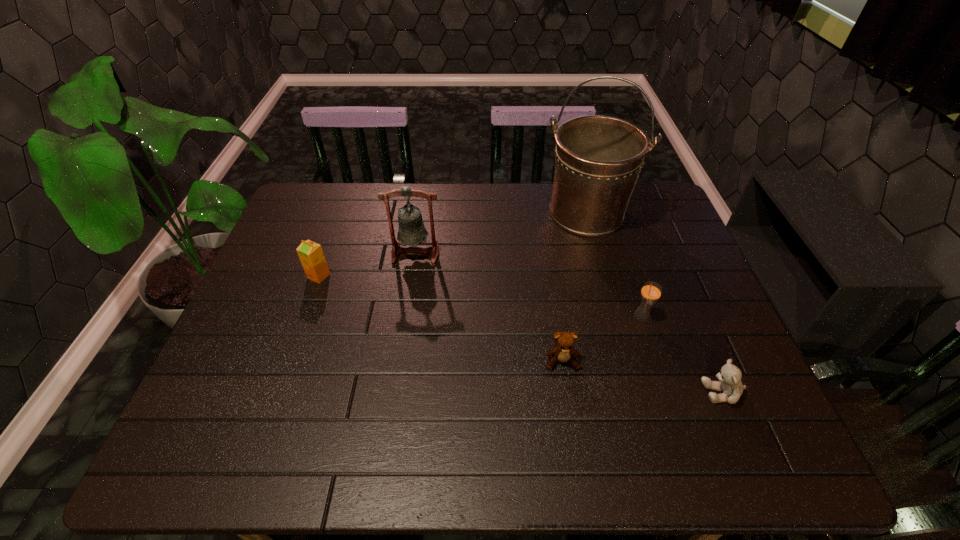
Identify which object is located as the fourth nearest to the fifth nearest object. Please provide its 2D coordinates. Your answer should be formatted as a tuple, i.e. [(x, y)], where the tuple contains the x and y coordinates of a point satisfying the conditions above.

[(651, 291)]

The image size is (960, 540). What are the coordinates of `free space in the image that satisfies the following two spatial constraints: 1. on the front side of the third nearest object; 2. on the left side of the fifth nearest object` in the screenshot? It's located at (406, 315).

What are the coordinates of `vacant area in the image that satisfies the following two spatial constraints: 1. on the front side of the fourth nearest object; 2. on the right side of the fourth farthest object` in the screenshot? It's located at coord(305,315).

The height and width of the screenshot is (540, 960). In order to click on vacant point that satisfies the following two spatial constraints: 1. on the front side of the straw; 2. on the right side of the farthest object in this screenshot , I will do `click(614, 315)`.